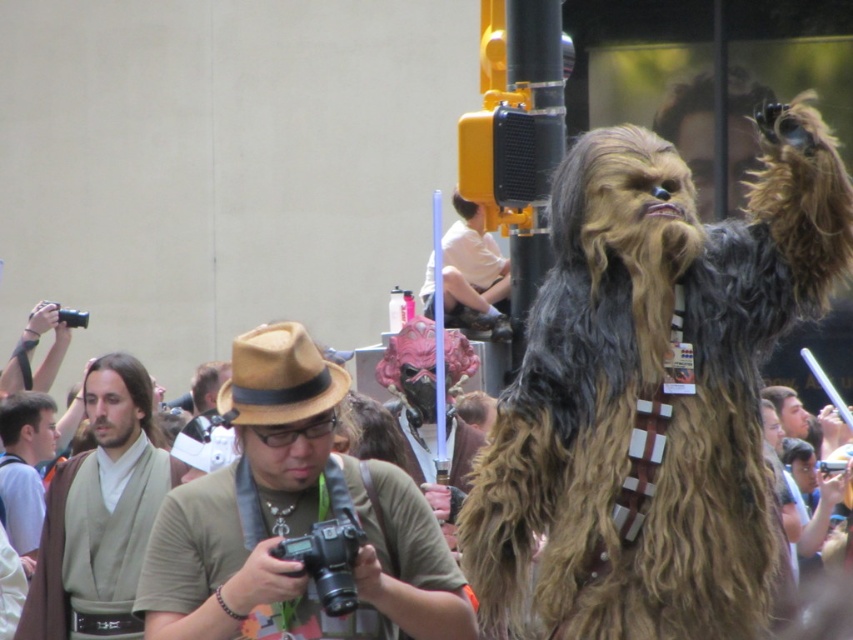
Question: Can you confirm if fuzzy brown fur at center is positioned above white cotton shirt at center?

Choices:
 (A) no
 (B) yes

Answer: (B)

Question: Estimate the real-world distances between objects in this image. Which object is farther from the brown felt hat at center?

Choices:
 (A) white cotton shirt at center
 (B) light brown fabric robe at center

Answer: (A)

Question: Estimate the real-world distances between objects in this image. Which object is farther from the light brown fabric robe at center?

Choices:
 (A) fuzzy brown fur at center
 (B) white cotton shirt at center
 (C) brown felt hat at center

Answer: (B)

Question: Does brown felt hat at center have a larger size compared to white cotton shirt at center?

Choices:
 (A) yes
 (B) no

Answer: (B)

Question: Which object appears farthest from the camera in this image?

Choices:
 (A) brown felt hat at center
 (B) fuzzy brown fur at center
 (C) light brown fabric robe at center

Answer: (C)

Question: Is white cotton shirt at center below light brown fabric robe at center?

Choices:
 (A) yes
 (B) no

Answer: (B)